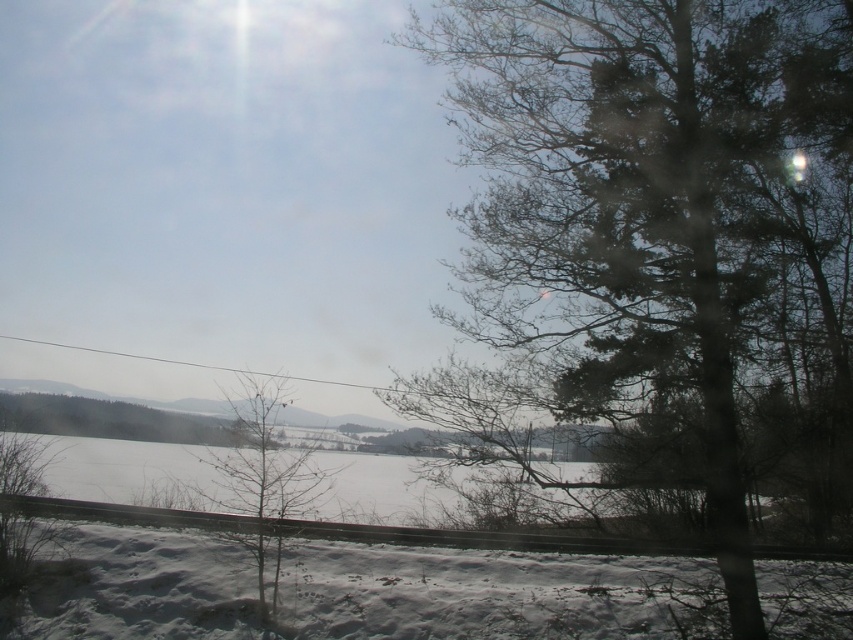
You are a photographer inside a car, and you want to capture the view outside. You notice the white fluffy snow at lower center and the bare branches at center. Which object appears bigger in the photo?

The white fluffy snow at lower center appears bigger in the photo because it is larger in size than the bare branches at center.

You are a passenger in a car driving through a snowy landscape. You notice the white fluffy snow at lower center and the bare branches at center. Which object is located to the right of the other?

The white fluffy snow at lower center is positioned on the right side of bare branches at center.

You are sitting inside a car and looking out the window. You see a dark green textured tree at right and white fluffy snow at lower center. Which object is higher in the scene?

The dark green textured tree at right is taller than the white fluffy snow at lower center.